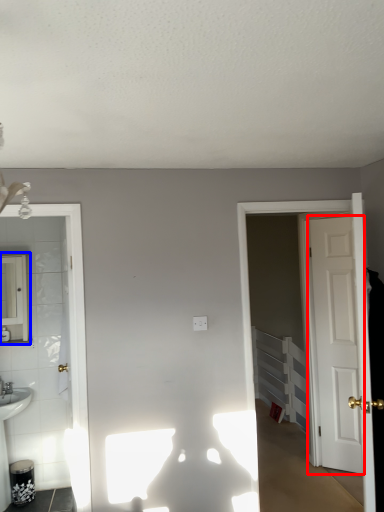
Question: Among these objects, which one is nearest to the camera, door (highlighted by a red box) or mirror (highlighted by a blue box)?

Choices:
 (A) door
 (B) mirror

Answer: (B)